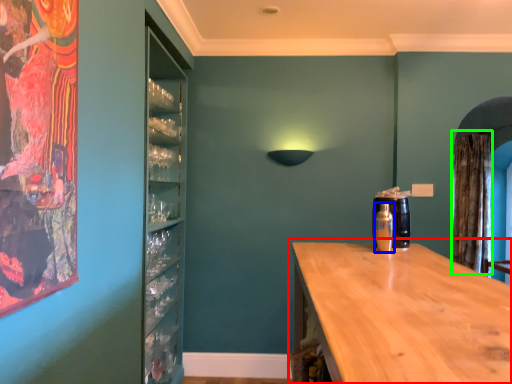
Question: Based on their relative distances, which object is farther from countertop (highlighted by a red box)? Choose from bottle (highlighted by a blue box) and curtain (highlighted by a green box).

Choices:
 (A) bottle
 (B) curtain

Answer: (B)